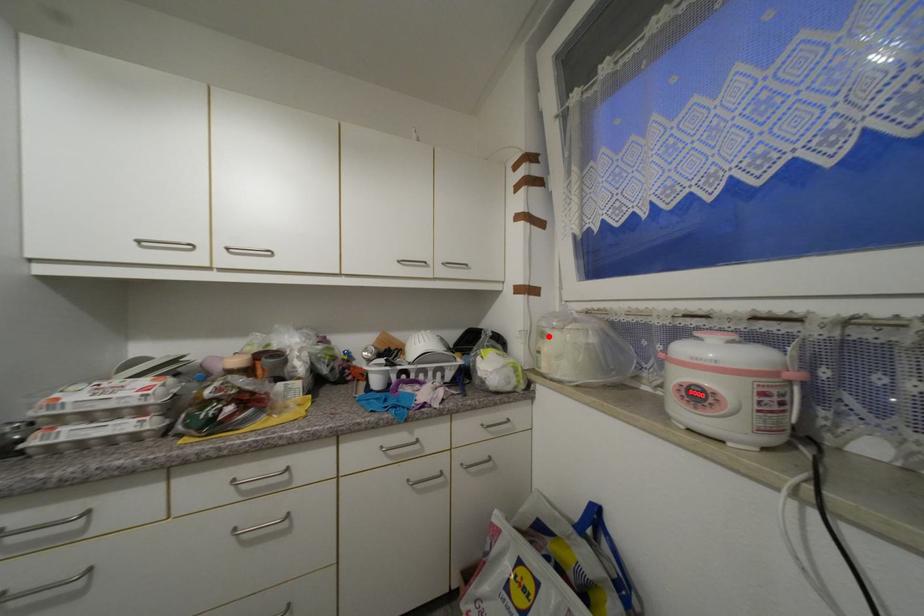
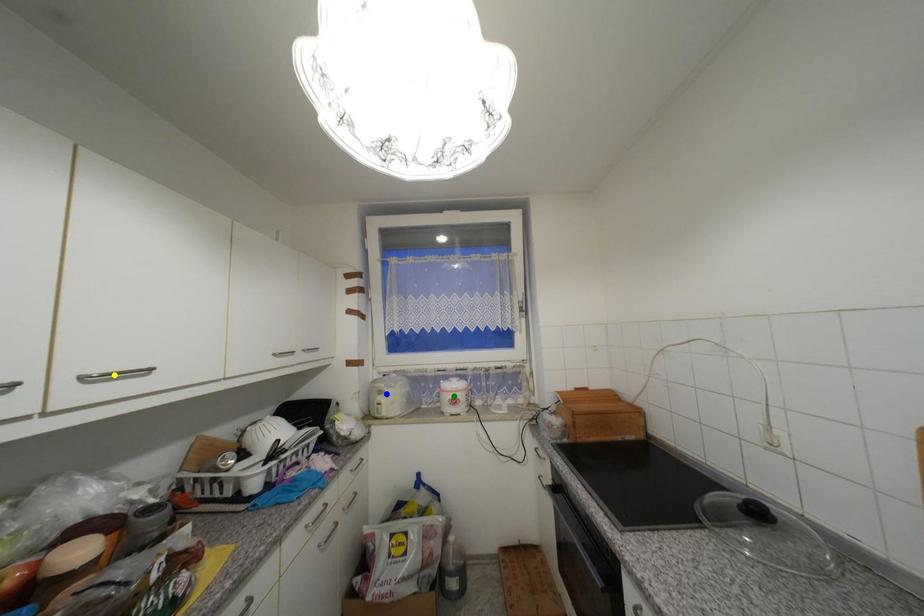
Question: I am providing you with two images of the same scene from different viewpoints. A red point is marked on the first image. You are given multiple points on the second image. Which spot in image 2 lines up with the point in image 1?

Choices:
 (A) green point
 (B) blue point
 (C) yellow point

Answer: (B)